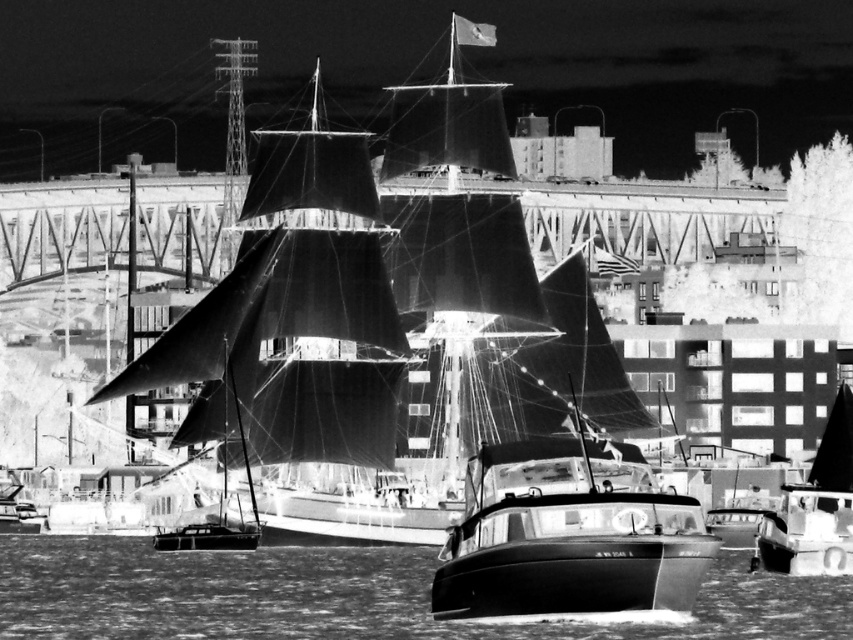
Does translucent water at lower center have a lesser width compared to smooth black sailboat at center?

No.

What do you see at coordinates (341, 596) in the screenshot? The height and width of the screenshot is (640, 853). I see `translucent water at lower center` at bounding box center [341, 596].

Find the location of a particular element. The image size is (853, 640). translucent water at lower center is located at coordinates (341, 596).